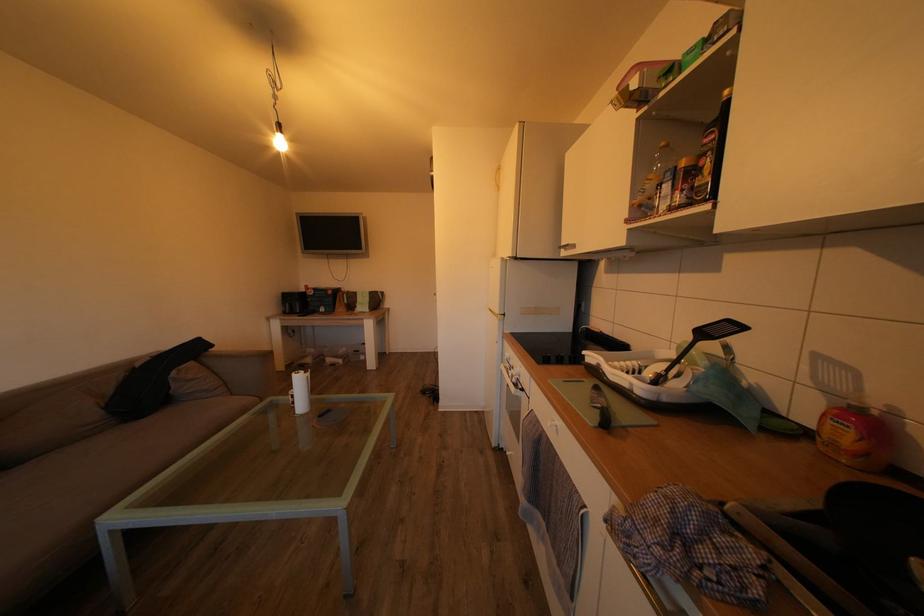
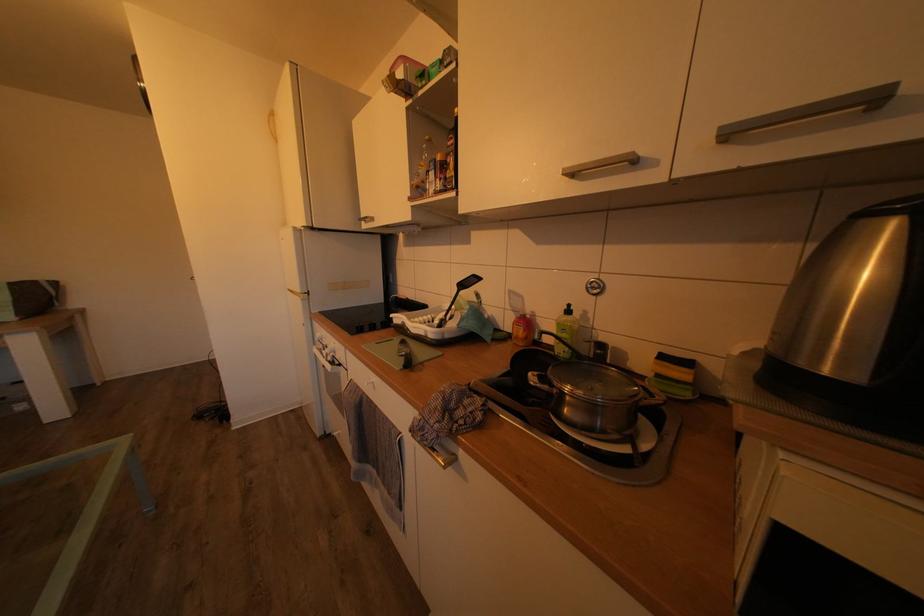
Question: The camera is either moving clockwise (left) or counter-clockwise (right) around the object. The first image is from the beginning of the video and the second image is from the end. Is the camera moving left or right when shooting the video?

Choices:
 (A) Left
 (B) Right

Answer: (A)